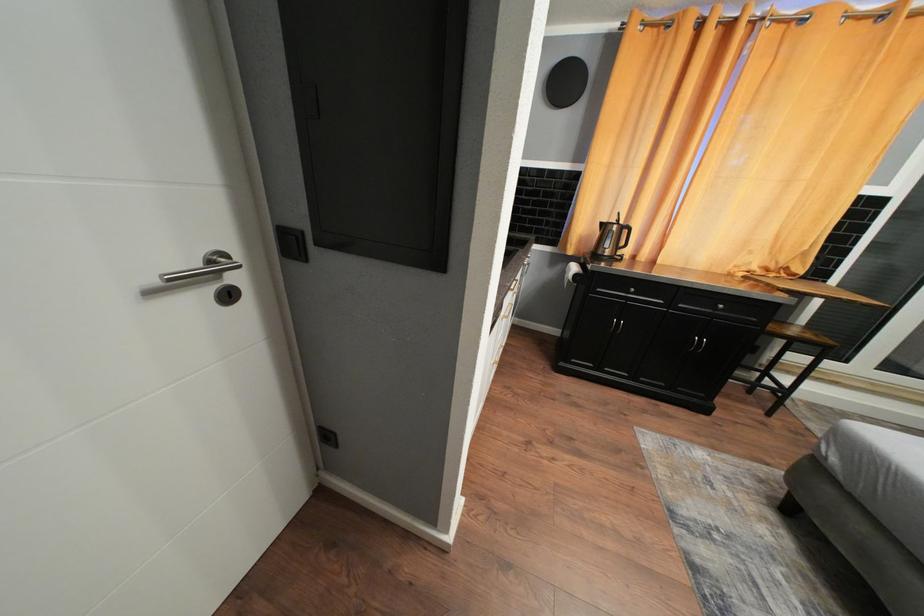
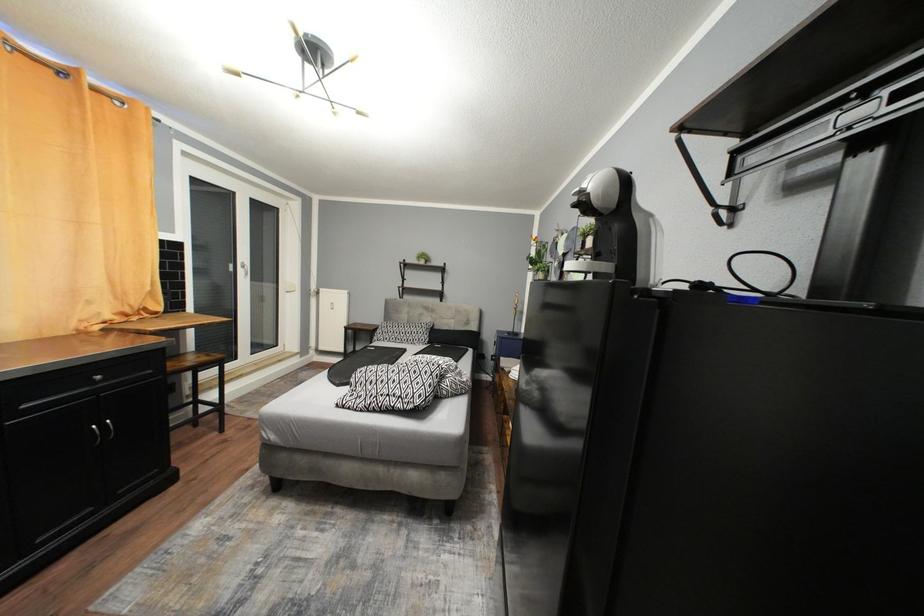
How did the camera likely rotate?

The camera rotated toward right-down.